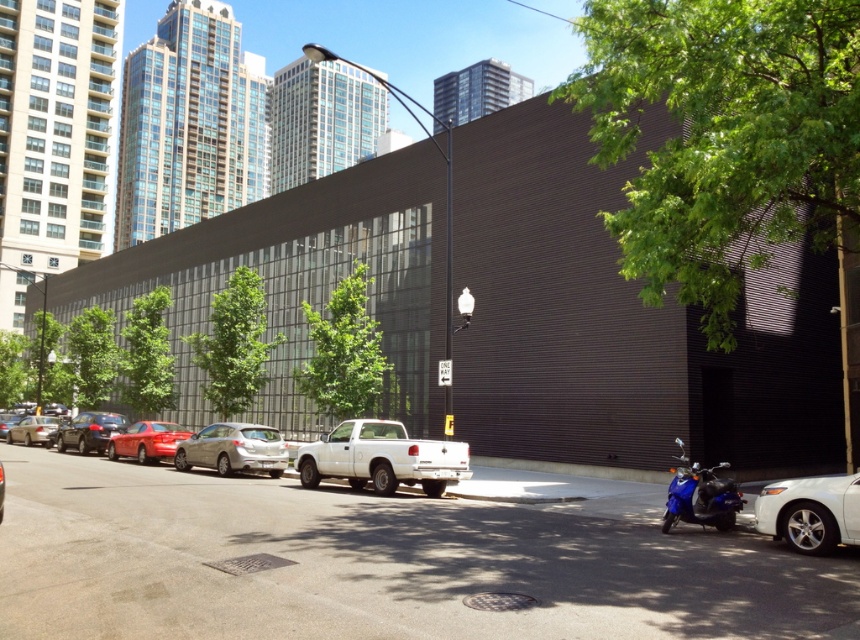
You are a delivery person trying to park your blue glossy scooter at lower right between two parked cars. The space between the shiny red sedan at center and the white car next to it is 1.2 meters. Can your scooter fit vertically in that space?

The blue glossy scooter at lower right is much taller than the shiny red sedan at center. Since the space between them is only 1.2 meters, the scooter may not fit vertically because its height exceeds the available space.

You are a delivery person needing to park your vehicle in a narrow alley that can only accommodate vehicles up to the width of the metallic silver sedan at center. Can the blue glossy scooter at lower right fit in this alley?

The blue glossy scooter at lower right is wider than the metallic silver sedan at center, so it cannot fit in the alley designed for vehicles up to the sedan width.

You are a delivery driver who needs to park your truck between the shiny red sedan at center and the metallic silver sedan at center. Can you fit your 5.5 meter long truck in the available space between them?

The shiny red sedan at center is shorter than the metallic silver sedan at center, but the exact distance between them isn t provided. Without knowing the space between the two sedans, it s impossible to determine if your 5.5 meter truck will fit.